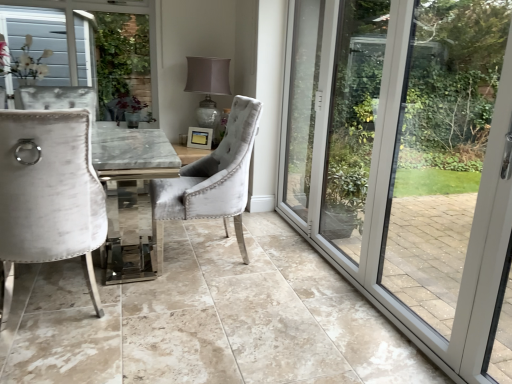
The image size is (512, 384). Find the location of `vacant region under velvet grey chair at center, which is counted as the first chair, starting from the right (from a real-world perspective)`. vacant region under velvet grey chair at center, which is counted as the first chair, starting from the right (from a real-world perspective) is located at coordinates (204, 254).